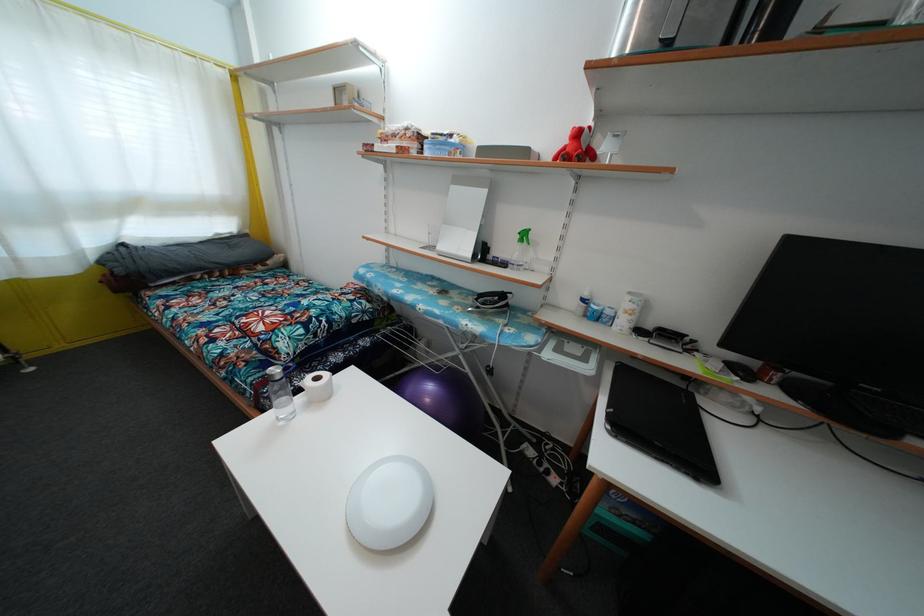
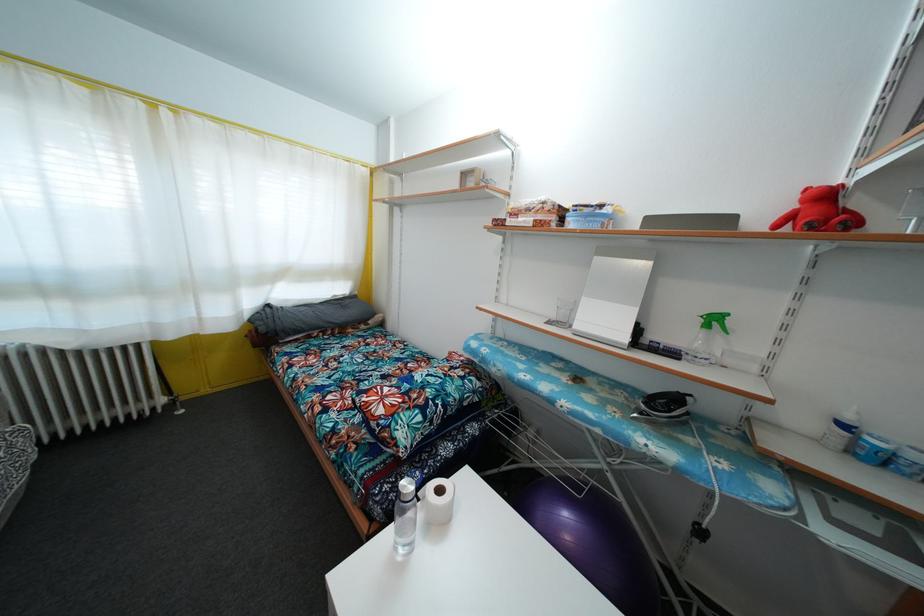
In the second image, find the point that corresponds to pixel 280 377 in the first image.

(410, 492)